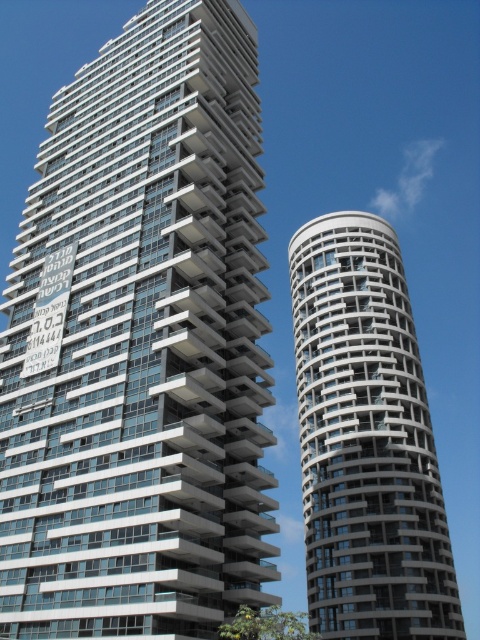
Does matte glass building at center have a smaller size compared to white textured building at right?

No.

Looking at this image, can you confirm if matte glass building at center is positioned below white textured building at right?

No, matte glass building at center is not below white textured building at right.

Locate an element on the screen. The image size is (480, 640). matte glass building at center is located at coordinates (141, 344).

Where is `matte glass building at center`? The width and height of the screenshot is (480, 640). matte glass building at center is located at coordinates (141, 344).